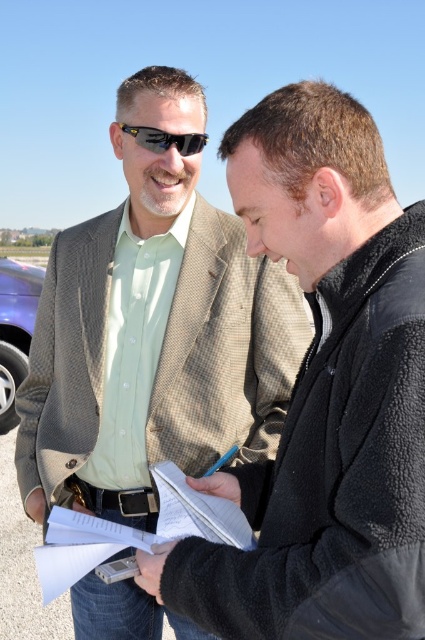
You are standing in the scene and need to locate the light brown textured blazer at center. According to the coordinates provided, where exactly would you find it?

The light brown textured blazer at center is located at point coordinates (323, 394).

You are a photographer trying to capture a clear shot of both the light brown textured blazer at center and the white paper at center. Since you want both objects in focus, which one should you focus on first to ensure the other is also in focus?

You should focus on the light brown textured blazer at center first because it is closer to the viewer than the white paper at center, so adjusting the focus to this object will help ensure the white paper at center is also in focus.